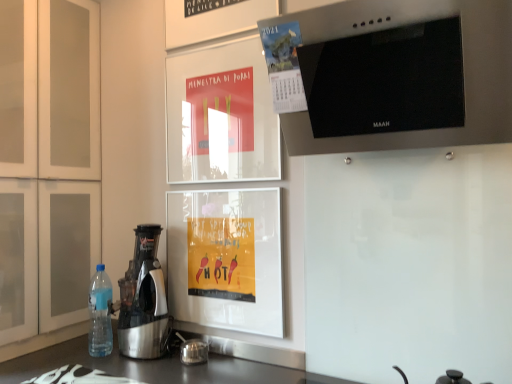
Question: In the image, is metallic calendar at upper center on the left side or the right side of stainless steel range hood at upper right?

Choices:
 (A) left
 (B) right

Answer: (A)

Question: From a real-world perspective, is metallic calendar at upper center above or below stainless steel range hood at upper right?

Choices:
 (A) above
 (B) below

Answer: (B)

Question: Which object is the farthest from the metallic silver juicer at left?

Choices:
 (A) white matte cabinet at left
 (B) blue plastic bottle at lower left
 (C) stainless steel range hood at upper right
 (D) metallic calendar at upper center

Answer: (C)

Question: Which object is positioned farthest from the metallic silver juicer at left?

Choices:
 (A) metallic calendar at upper center
 (B) stainless steel range hood at upper right
 (C) white matte cabinet at left
 (D) blue plastic bottle at lower left

Answer: (B)